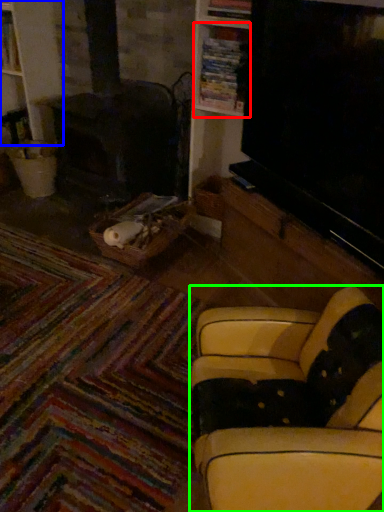
Question: Estimate the real-world distances between objects in this image. Which object is closer to shelf (highlighted by a red box), bookshelf (highlighted by a blue box) or studio couch (highlighted by a green box)?

Choices:
 (A) bookshelf
 (B) studio couch

Answer: (A)